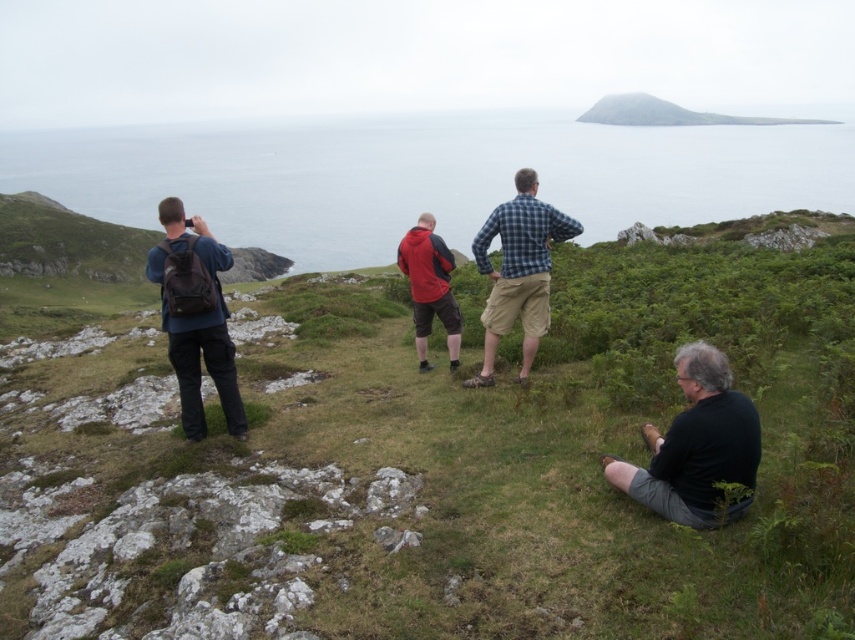
You are a photographer trying to capture a clear shot of the distant island. You notice two items in the foreground that might obstruct your view. Which item is closer to your camera, the black matte shirt at lower right or the matte black backpack at left?

The black matte shirt at lower right is closer to the viewer than the matte black backpack at left, so it would be the closer obstruction to your camera.

You are a photographer trying to capture a landscape photo. You notice the black matte shirt at lower right and the smooth gray rock at upper center in your frame. Which object is shorter in your view?

The black matte shirt at lower right is shorter than the smooth gray rock at upper center.

Consider the image. You are a photographer trying to capture a group photo of everyone in the scene. You want to position yourself so that you can include all four people in the frame. Given the current arrangement, where should you stand relative to the black matte shirt at lower right to ensure everyone is visible?

To include all four people in the frame, you should position yourself to the left of the black matte shirt at lower right since it is located at the far right edge of the group, allowing you to capture the entire group including the person on the left taking the photo.